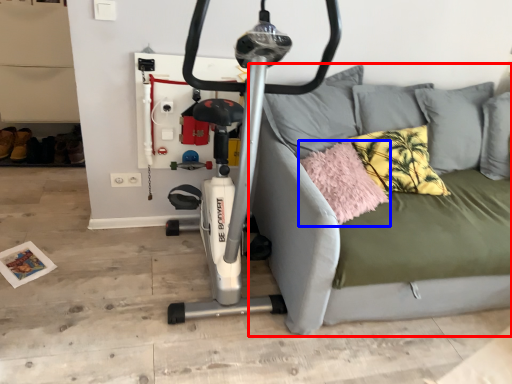
Question: Which point is closer to the camera, studio couch (highlighted by a red box) or pillow (highlighted by a blue box)?

Choices:
 (A) studio couch
 (B) pillow

Answer: (A)